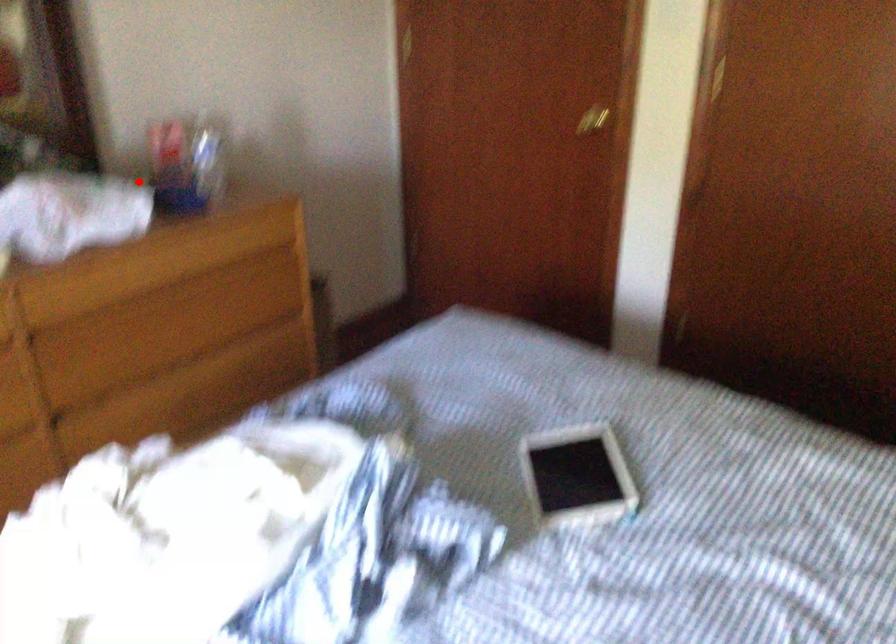
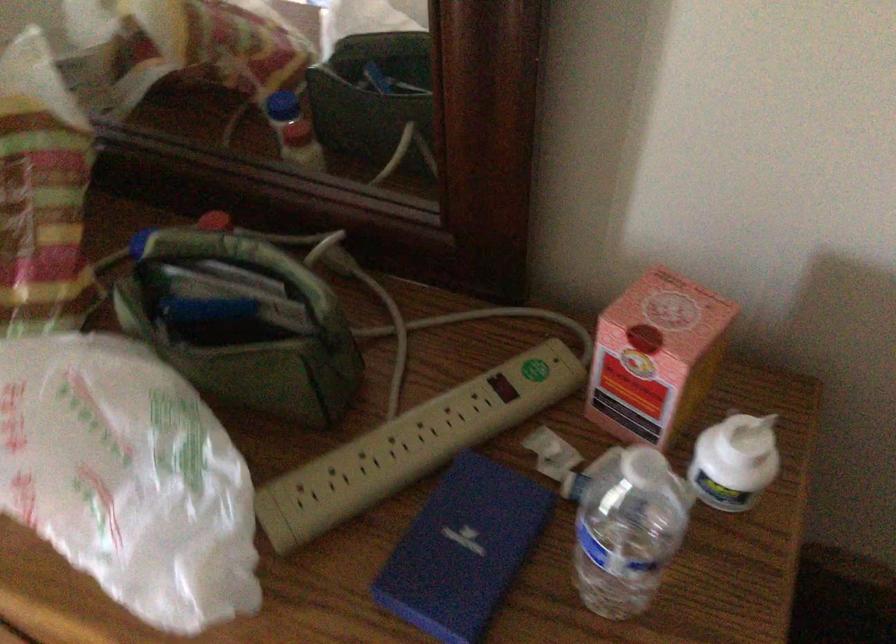
Locate, in the second image, the point that corresponds to the highlighted location in the first image.

(503, 386)